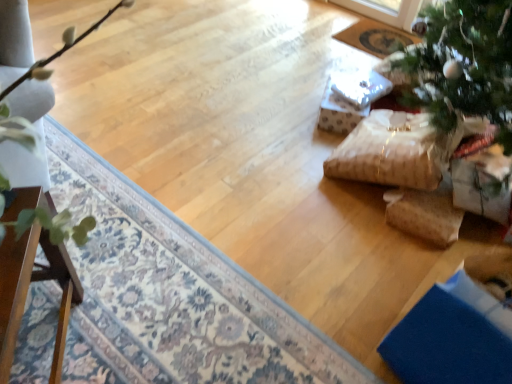
You are a GUI agent. You are given a task and a screenshot of the screen. Output one action in this format:
    pyautogui.click(x=<x>, y=<y>)
    Task: Click on the vacant point to the right of wooden coffee table at lower left
    
    Given the screenshot: What is the action you would take?
    pyautogui.click(x=139, y=347)